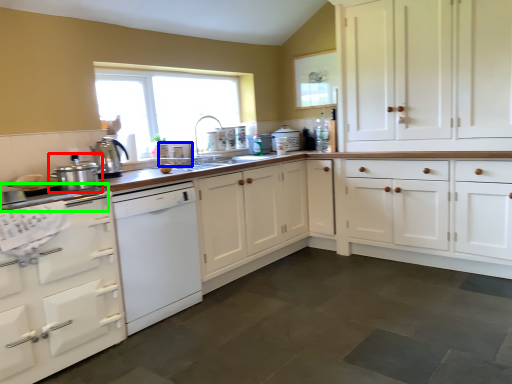
Question: Based on their relative distances, which object is farther from kitchen appliance (highlighted by a red box)? Choose from appliance (highlighted by a blue box) and appliance (highlighted by a green box).

Choices:
 (A) appliance
 (B) appliance

Answer: (A)